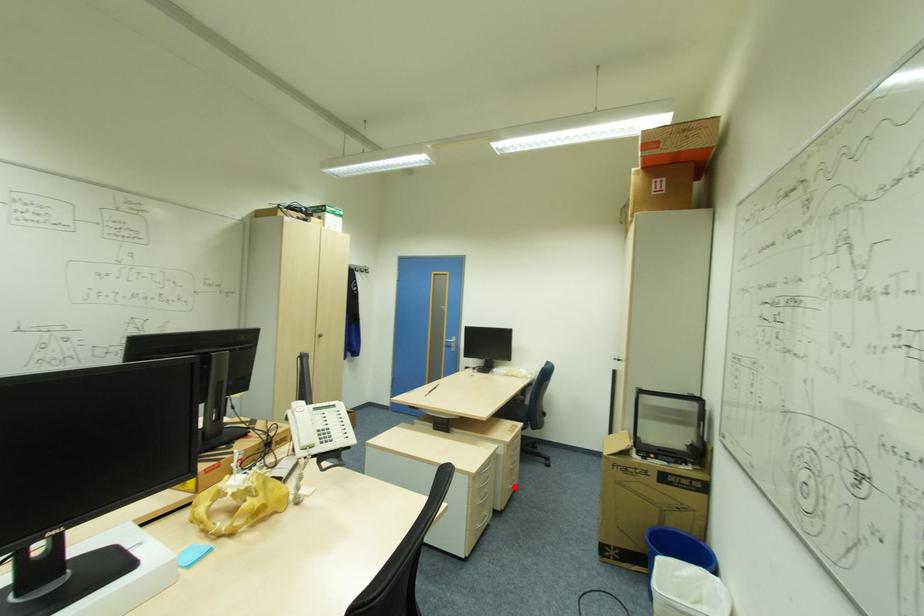
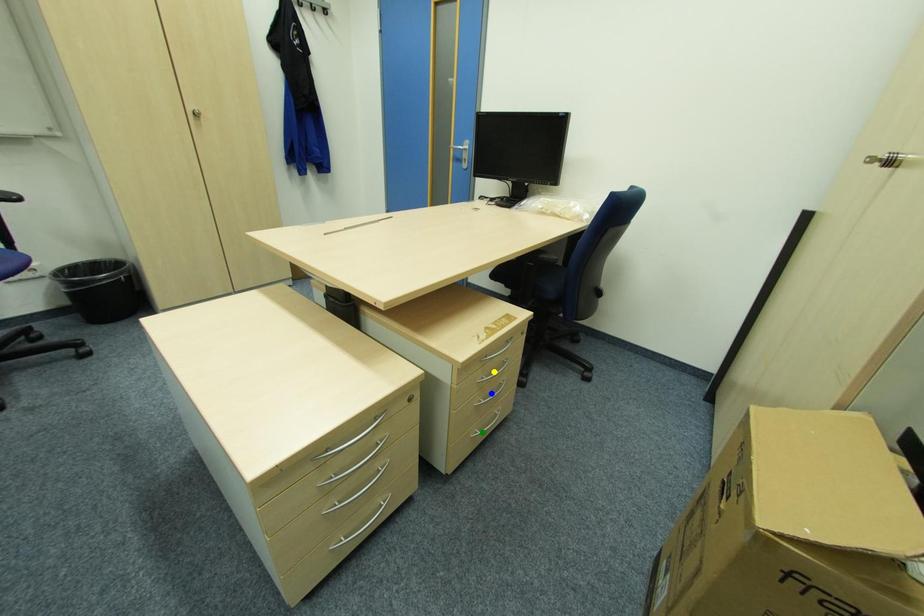
Question: I am providing you with two images of the same scene from different viewpoints. A red point is marked on the first image. You are given multiple points on the second image. Which point in image 2 is actually the same real-world point as the red point in image 1?

Choices:
 (A) yellow point
 (B) blue point
 (C) green point

Answer: (C)